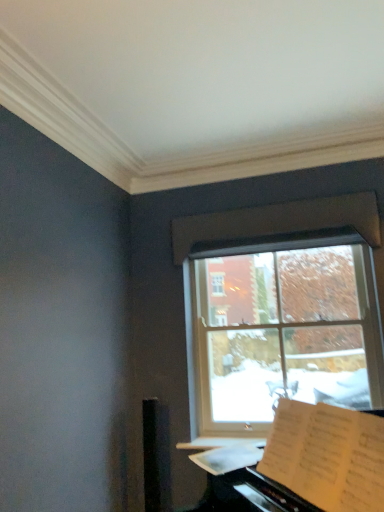
Image resolution: width=384 pixels, height=512 pixels. Describe the element at coordinates (230, 456) in the screenshot. I see `white paper sheet music at lower right` at that location.

Where is `clear glass window at center`? This screenshot has height=512, width=384. clear glass window at center is located at coordinates (280, 311).

Who is shorter, clear glass window at center or white paper at lower right?

white paper at lower right is shorter.

Is point (253, 344) closer to camera compared to point (303, 439)?

No, it is not.

Is clear glass window at center aimed at white paper at lower right?

Yes.

Is clear glass window at center far from white paper at lower right?

That's right, there is a large distance between clear glass window at center and white paper at lower right.

Is white paper at lower right located outside white paper sheet music at lower right?

Absolutely, white paper at lower right is external to white paper sheet music at lower right.

In terms of width, does white paper at lower right look wider or thinner when compared to white paper sheet music at lower right?

Considering their sizes, white paper at lower right looks broader than white paper sheet music at lower right.

Considering the sizes of objects white paper at lower right and white paper sheet music at lower right in the image provided, who is smaller, white paper at lower right or white paper sheet music at lower right?

white paper sheet music at lower right.

Does white paper at lower right come in front of white paper sheet music at lower right?

Yes, it is in front of white paper sheet music at lower right.

Locate an element on the screen. The height and width of the screenshot is (512, 384). piano below the clear glass window at center (from the image's perspective) is located at coordinates (327, 456).

Does white paper at lower right come behind clear glass window at center?

No, it is in front of clear glass window at center.

Is the surface of white paper at lower right in direct contact with clear glass window at center?

No, white paper at lower right is not next to clear glass window at center.

Is white paper sheet music at lower right wider or thinner than white paper at lower right?

white paper sheet music at lower right is thinner than white paper at lower right.

Is white paper at lower right inside white paper sheet music at lower right?

No, white paper at lower right is not a part of white paper sheet music at lower right.

Does point (224, 452) lie in front of point (347, 413)?

That is False.

Identify the location of piano that is under the white paper sheet music at lower right (from a real-world perspective). This screenshot has height=512, width=384. (327, 456).

From the image's perspective, which one is positioned higher, white paper sheet music at lower right or clear glass window at center?

From the image's view, clear glass window at center is above.

Does white paper sheet music at lower right have a lesser height compared to clear glass window at center?

Correct, white paper sheet music at lower right is not as tall as clear glass window at center.

Would you say white paper sheet music at lower right contains clear glass window at center?

Actually, clear glass window at center is outside white paper sheet music at lower right.

In order to click on window above the white paper sheet music at lower right (from a real-world perspective) in this screenshot , I will do `click(280, 311)`.

How distant is clear glass window at center from white paper sheet music at lower right?

clear glass window at center and white paper sheet music at lower right are 1.10 meters apart.

Is clear glass window at center positioned far away from white paper sheet music at lower right?

Yes, clear glass window at center and white paper sheet music at lower right are located far from each other.

Is clear glass window at center oriented towards white paper sheet music at lower right?

Yes, clear glass window at center is aimed at white paper sheet music at lower right.

At what (x,y) coordinates should I click in order to perform the action: click on piano directly beneath the clear glass window at center (from a real-world perspective). Please return your answer as a coordinate pair (x, y). Looking at the image, I should click on (327, 456).

At what (x,y) coordinates should I click in order to perform the action: click on sheet music behind the white paper at lower right. Please return your answer as a coordinate pair (x, y). The image size is (384, 512). Looking at the image, I should click on (230, 456).

Based on their spatial positions, is white paper sheet music at lower right or clear glass window at center further from white paper at lower right?

clear glass window at center.

When comparing their distances from clear glass window at center, does white paper at lower right or white paper sheet music at lower right seem closer?

The object closer to clear glass window at center is white paper sheet music at lower right.

Based on their spatial positions, is clear glass window at center or white paper sheet music at lower right closer to white paper at lower right?

white paper sheet music at lower right is positioned closer to the anchor white paper at lower right.

Based on their spatial positions, is clear glass window at center or white paper at lower right further from white paper sheet music at lower right?

clear glass window at center lies further to white paper sheet music at lower right than the other object.

Looking at the image, which one is located further to white paper sheet music at lower right, white paper at lower right or clear glass window at center?

clear glass window at center is further to white paper sheet music at lower right.

Considering their positions, is white paper sheet music at lower right positioned further to clear glass window at center than white paper at lower right?

The object further to clear glass window at center is white paper at lower right.

Image resolution: width=384 pixels, height=512 pixels. Identify the location of sheet music between white paper at lower right and clear glass window at center in the front-back direction. (230, 456).